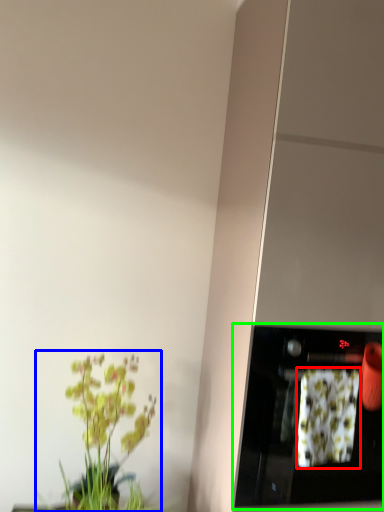
Question: Which is nearer to the flower (highlighted by a red box)? houseplant (highlighted by a blue box) or appliance (highlighted by a green box).

Choices:
 (A) houseplant
 (B) appliance

Answer: (B)